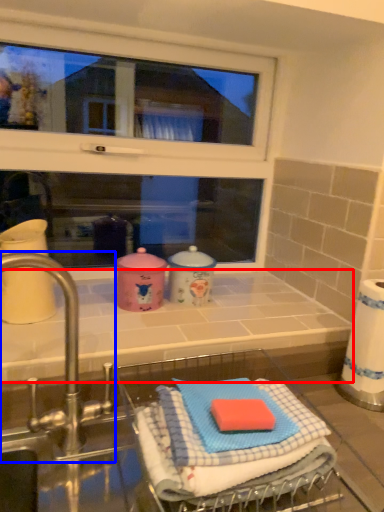
Question: Which object is further to the camera taking this photo, counter top (highlighted by a red box) or tap (highlighted by a blue box)?

Choices:
 (A) counter top
 (B) tap

Answer: (A)